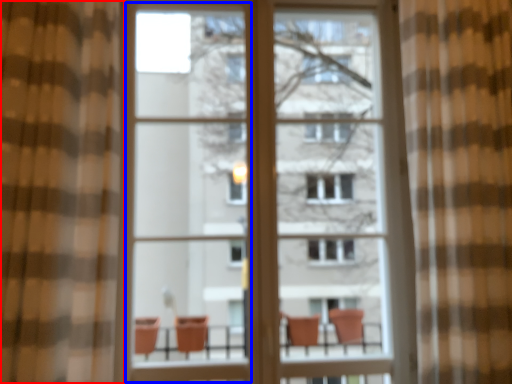
Question: Which object is closer to the camera taking this photo, curtain (highlighted by a red box) or screen door (highlighted by a blue box)?

Choices:
 (A) curtain
 (B) screen door

Answer: (A)